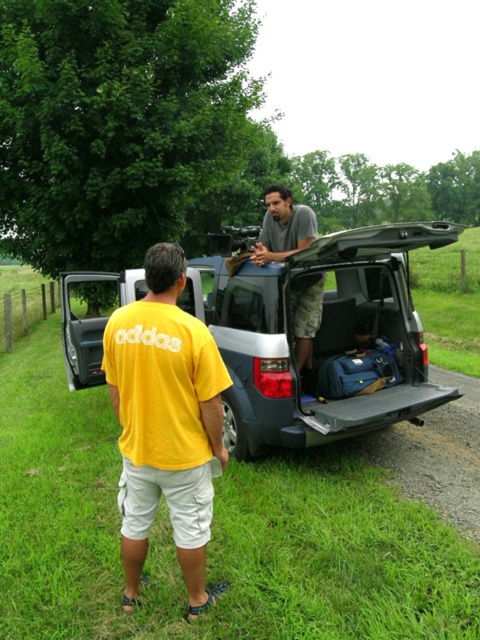
You are trying to decide whether to place a large backpack on the ground between the satin silver jeep at center and the yellow cotton shirt at center. Based on their heights, which object should the backpack be placed closer to to ensure it doesn

The satin silver jeep at center is taller than the yellow cotton shirt at center. Therefore, the backpack should be placed closer to the satin silver jeep at center to ensure it is within reach without needing to stretch too far.

You are a photographer trying to capture a photo of both the yellow cotton shirt at center and the gray cotton shirt at center. Since you want to ensure both are fully visible in the frame, which person should you position closer to the camera to avoid cropping the top of their shirt?

The yellow cotton shirt at center is shorter than the gray cotton shirt at center. To ensure both are fully visible, position the yellow cotton shirt at center closer to the camera so its shorter height stays in frame while the taller gray cotton shirt at center can be adjusted accordingly.